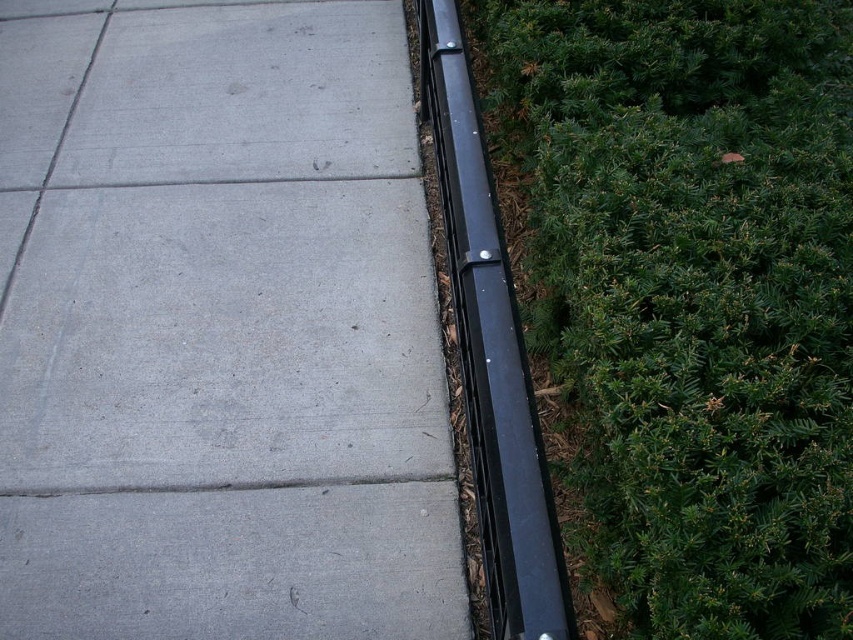
You are a delivery robot positioned at point 0.5, 0.25 on the sidewalk. You need to deliver a package to the gray concrete pavement at center. Which direction should you move to reach it?

The gray concrete pavement at center is located at point (219, 332), so you should move slightly northeast to reach it from your current position at (212, 320).

You are a gardener standing on the sidewalk and want to trim the green leafy hedge at right and the black metal curb at right. Which object should you approach first based on their positions?

You should approach the green leafy hedge at right first because it is closer to you than the black metal curb at right, which is further away.

You are a gardener trying to trim the green leafy hedge at right and the black metal curb at right. Which object requires more space to work around?

The green leafy hedge at right might be wider than the black metal curb at right, so it requires more space to work around.